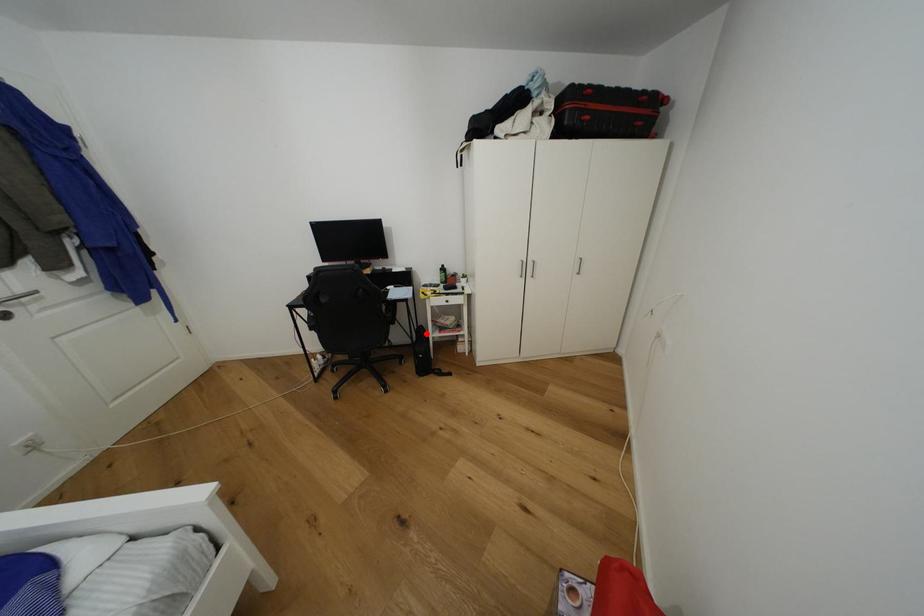
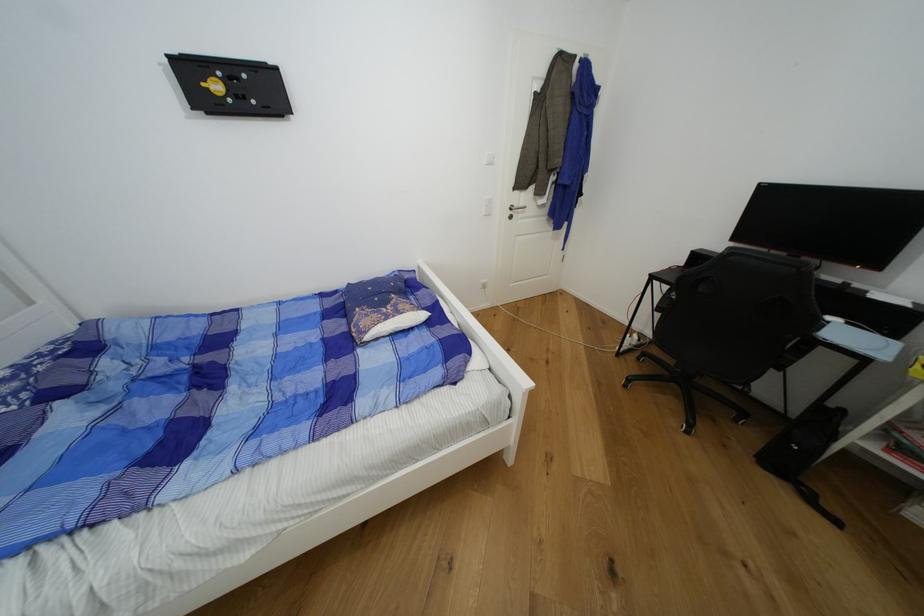
Question: A red point is marked in image1. In image2, is the corresponding 3D point closer to the camera or farther? Reply with the corresponding letter.

Choices:
 (A) The corresponding 3D point is closer.
 (B) The corresponding 3D point is farther.

Answer: (B)